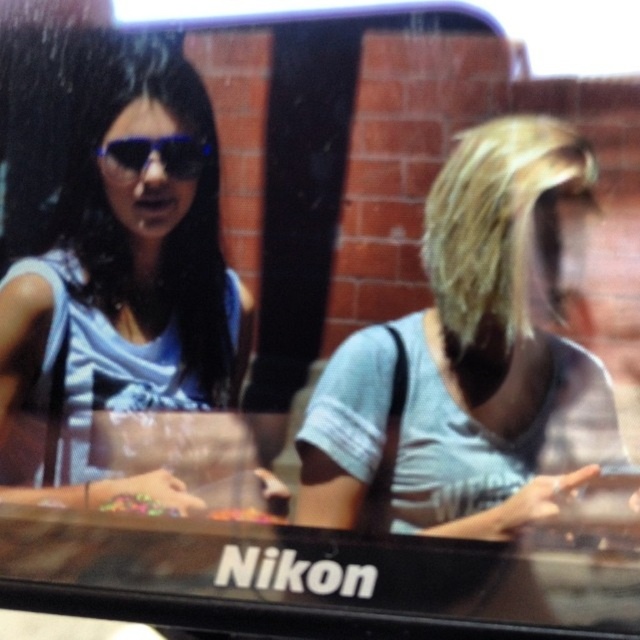
You are a delivery robot that needs to place a small package between the matte blue sunglasses at upper left and the translucent plastic candy at center. The package requires at least 24 inches of space. Can you fit it there?

The matte blue sunglasses at upper left and translucent plastic candy at center are 24.80 inches apart, so yes, the package can be placed between them as the required space is met.

You are a fashion designer analyzing the image. The point at coordinates (131, 257) is marked in the image. Based on the scene description, what does this point indicate?

The point at coordinates (131, 257) marks the location of the matte blue dress at upper left.

You are a tailor who needs to determine if the gray cotton shirt at right can fit into a garment bag designed for items up to 30 cm in width. The matte blue sunglasses at upper left are 15 cm wide. Can the shirt fit?

The gray cotton shirt at right might be wider than matte blue sunglasses at upper left which are 15 cm wide. If the shirt is wider than 15 cm but still under 30 cm, it could fit. However, if it exceeds 30 cm, it won